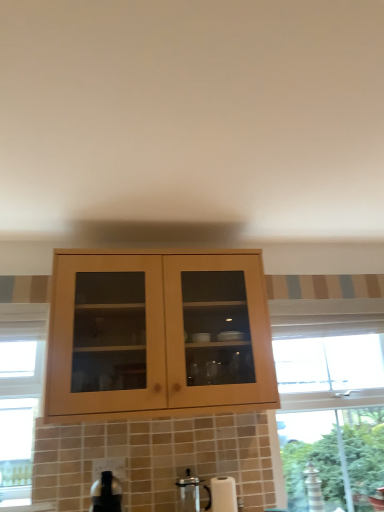
Describe the element at coordinates (190, 493) in the screenshot. I see `satin silver coffee machine at lower center` at that location.

Where is `satin silver coffee machine at lower center`? The height and width of the screenshot is (512, 384). satin silver coffee machine at lower center is located at coordinates pos(190,493).

Describe the element at coordinates (106, 494) in the screenshot. The height and width of the screenshot is (512, 384). I see `satin silver kettle at lower center` at that location.

You are a GUI agent. You are given a task and a screenshot of the screen. Output one action in this format:
    pyautogui.click(x=<x>, y=<y>)
    Task: Click on the satin silver kettle at lower center
    
    Given the screenshot: What is the action you would take?
    pyautogui.click(x=106, y=494)

Where is `satin silver coffee machine at lower center`? The width and height of the screenshot is (384, 512). satin silver coffee machine at lower center is located at coordinates (190, 493).

Considering the relative positions of satin silver coffee machine at lower center and satin silver kettle at lower center in the image provided, is satin silver coffee machine at lower center to the left of satin silver kettle at lower center from the viewer's perspective?

In fact, satin silver coffee machine at lower center is to the right of satin silver kettle at lower center.

Which is behind, satin silver coffee machine at lower center or satin silver kettle at lower center?

satin silver coffee machine at lower center is further from the camera.

Does point (189, 477) appear closer or farther from the camera than point (116, 489)?

Point (189, 477).

From the image's perspective, who appears lower, satin silver coffee machine at lower center or satin silver kettle at lower center?

satin silver coffee machine at lower center, from the image's perspective.

From a real-world perspective, which object stands above the other?

From a 3D spatial view, satin silver kettle at lower center is above.

Considering the sizes of objects satin silver coffee machine at lower center and satin silver kettle at lower center in the image provided, who is wider, satin silver coffee machine at lower center or satin silver kettle at lower center?

satin silver kettle at lower center.

From the picture: Does satin silver coffee machine at lower center have a greater height compared to satin silver kettle at lower center?

Indeed, satin silver coffee machine at lower center has a greater height compared to satin silver kettle at lower center.

Which of these two, satin silver coffee machine at lower center or satin silver kettle at lower center, is bigger?

With larger size is satin silver kettle at lower center.

Looking at this image, would you say satin silver coffee machine at lower center contains satin silver kettle at lower center?

That's incorrect, satin silver kettle at lower center is not inside satin silver coffee machine at lower center.

Are satin silver coffee machine at lower center and satin silver kettle at lower center far apart?

No, there isn't a large distance between satin silver coffee machine at lower center and satin silver kettle at lower center.

Is satin silver coffee machine at lower center oriented towards satin silver kettle at lower center?

No, satin silver coffee machine at lower center is not facing towards satin silver kettle at lower center.

Can you tell me how much satin silver coffee machine at lower center and satin silver kettle at lower center differ in facing direction?

0.691 degrees separate the facing orientations of satin silver coffee machine at lower center and satin silver kettle at lower center.

Locate an element on the screen. coffee machine that is on the right side of satin silver kettle at lower center is located at coordinates coord(190,493).

Considering the relative positions of satin silver kettle at lower center and satin silver coffee machine at lower center in the image provided, is satin silver kettle at lower center to the left of satin silver coffee machine at lower center from the viewer's perspective?

Yes, satin silver kettle at lower center is to the left of satin silver coffee machine at lower center.

Is the position of satin silver kettle at lower center more distant than that of satin silver coffee machine at lower center?

No, satin silver kettle at lower center is in front of satin silver coffee machine at lower center.

Which is in front, point (119, 496) or point (194, 477)?

The point (119, 496) is in front.

From the image's perspective, relative to satin silver coffee machine at lower center, is satin silver kettle at lower center above or below?

From the image's perspective, satin silver kettle at lower center appears above satin silver coffee machine at lower center.

From a real-world perspective, does satin silver kettle at lower center sit lower than satin silver coffee machine at lower center?

Actually, satin silver kettle at lower center is physically above satin silver coffee machine at lower center in the real world.

Between satin silver kettle at lower center and satin silver coffee machine at lower center, which one has smaller width?

satin silver coffee machine at lower center.

Which of these two, satin silver kettle at lower center or satin silver coffee machine at lower center, stands taller?

Standing taller between the two is satin silver coffee machine at lower center.

Is satin silver kettle at lower center bigger than satin silver coffee machine at lower center?

Yes, satin silver kettle at lower center is bigger than satin silver coffee machine at lower center.

Would you say satin silver coffee machine at lower center is part of satin silver kettle at lower center's contents?

No, satin silver coffee machine at lower center is located outside of satin silver kettle at lower center.

Is satin silver kettle at lower center next to satin silver coffee machine at lower center and touching it?

No.

Does satin silver kettle at lower center turn towards satin silver coffee machine at lower center?

No, satin silver kettle at lower center is not aimed at satin silver coffee machine at lower center.

Looking at this image, what's the angular difference between satin silver kettle at lower center and satin silver coffee machine at lower center's facing directions?

satin silver kettle at lower center and satin silver coffee machine at lower center are facing 0.691 degrees away from each other.

Identify the location of coffee machine to the right of satin silver kettle at lower center. (190, 493).

The width and height of the screenshot is (384, 512). What are the coordinates of `appliance above the satin silver coffee machine at lower center (from a real-world perspective)` in the screenshot? It's located at (106, 494).

In order to click on appliance on the left of satin silver coffee machine at lower center in this screenshot , I will do `click(106, 494)`.